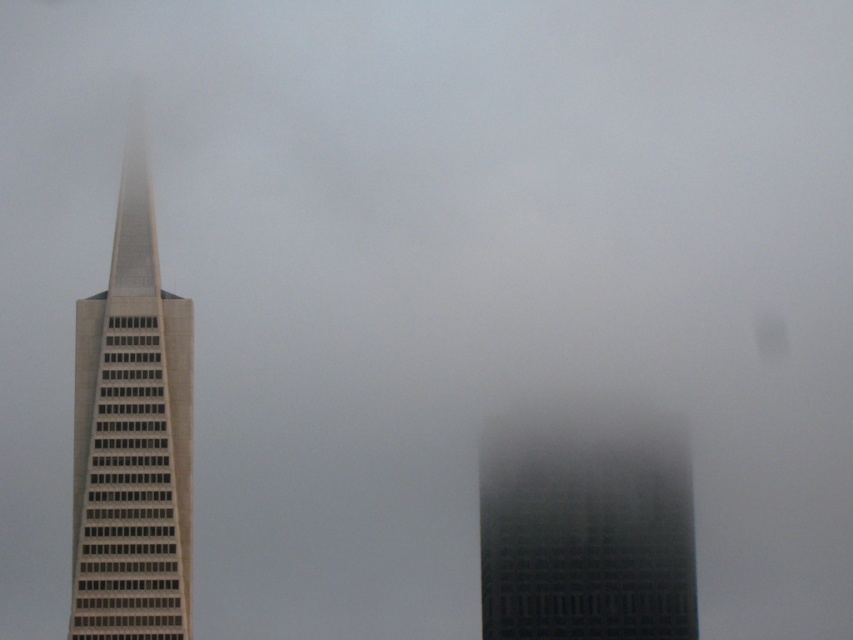
Describe the element at coordinates (132, 435) in the screenshot. I see `beige glass skyscraper at left` at that location.

Can you confirm if beige glass skyscraper at left is taller than dark gray glass building at center?

Yes, beige glass skyscraper at left is taller than dark gray glass building at center.

This screenshot has width=853, height=640. What do you see at coordinates (132, 435) in the screenshot?
I see `beige glass skyscraper at left` at bounding box center [132, 435].

You are a GUI agent. You are given a task and a screenshot of the screen. Output one action in this format:
    pyautogui.click(x=<x>, y=<y>)
    Task: Click on the beige glass skyscraper at left
    Image resolution: width=853 pixels, height=640 pixels.
    Given the screenshot: What is the action you would take?
    pyautogui.click(x=132, y=435)